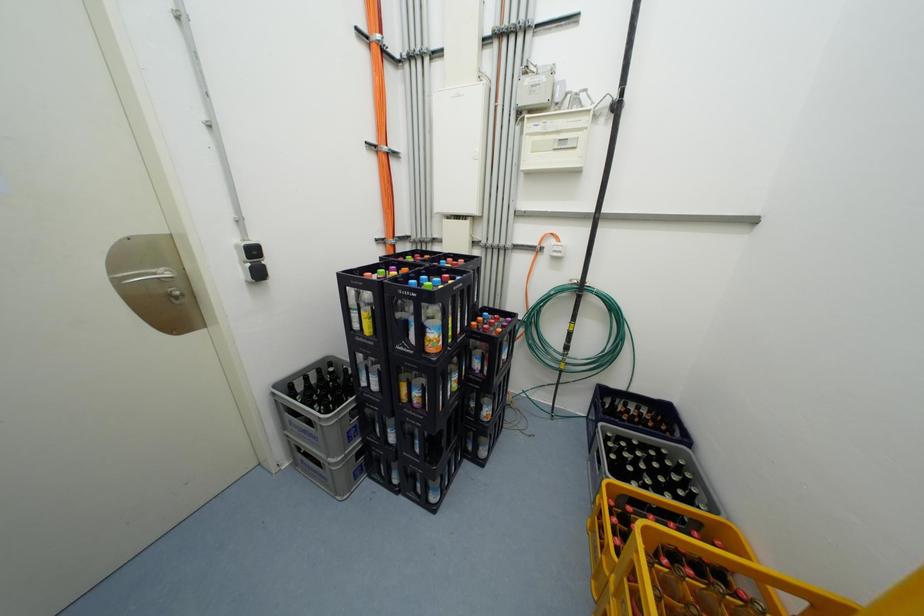
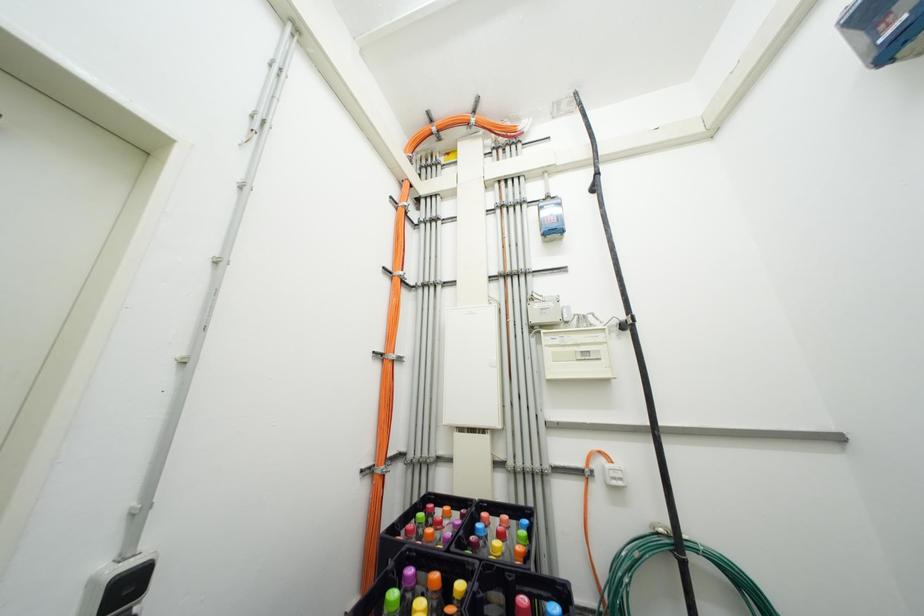
Question: The first image is from the beginning of the video and the second image is from the end. How did the camera likely rotate when shooting the video?

Choices:
 (A) Left
 (B) Right
 (C) Up
 (D) Down

Answer: (C)